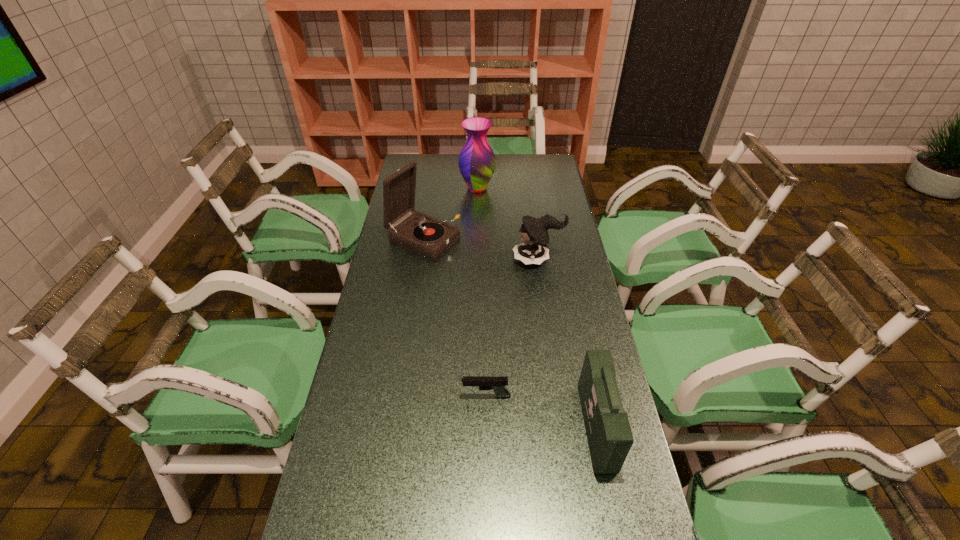
What are the coordinates of `free space between the shortest object and the first-aid kit` in the screenshot? It's located at (541, 412).

I want to click on free spot between the doll and the first-aid kit, so point(567,343).

Locate an element on the screen. free space between the shortest object and the phonograph record is located at coordinates (455, 318).

Where is `object that ranks as the closest to the doll`? object that ranks as the closest to the doll is located at coordinates (424, 235).

Identify which object is located as the third nearest to the first-aid kit. Please provide its 2D coordinates. Your answer should be formatted as a tuple, i.e. [(x, y)], where the tuple contains the x and y coordinates of a point satisfying the conditions above.

[(424, 235)]